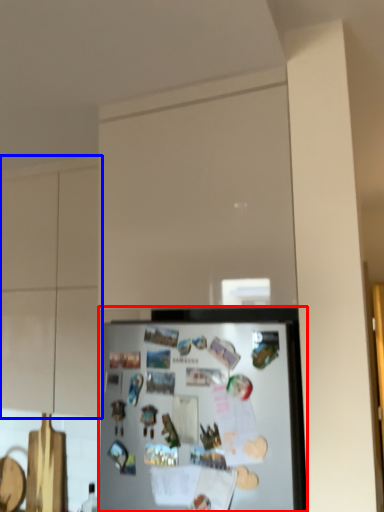
Question: Which object appears farthest to the camera in this image, refrigerator (highlighted by a red box) or cabinetry (highlighted by a blue box)?

Choices:
 (A) refrigerator
 (B) cabinetry

Answer: (B)